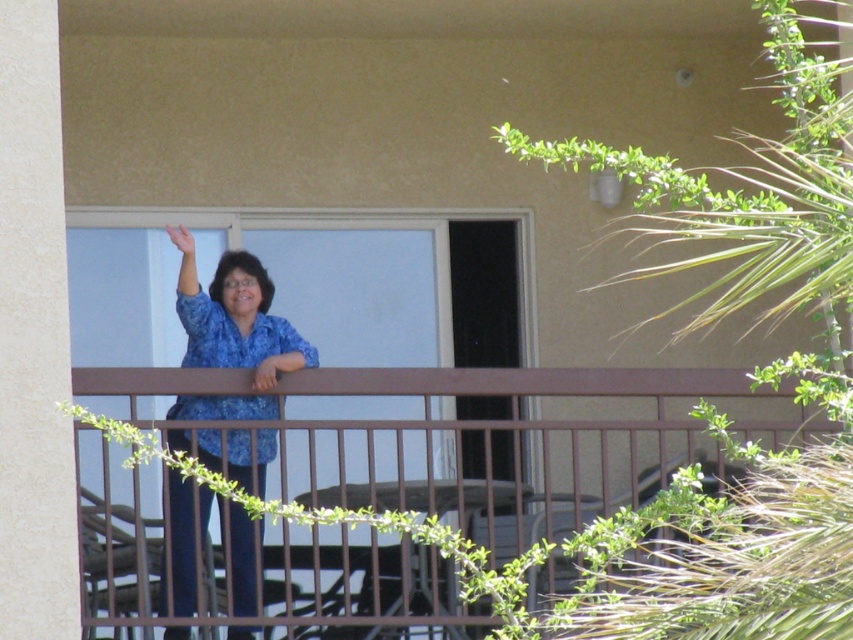
Question: Which point appears closest to the camera in this image?

Choices:
 (A) (262, 372)
 (B) (173, 557)
 (C) (184, 260)
 (D) (677, 556)

Answer: (D)

Question: Estimate the real-world distances between objects in this image. Which object is closer to the smooth brown hand at center?

Choices:
 (A) matte skin hand at upper center
 (B) matte blue shirt at upper left
 (C) blue printed blouse at center

Answer: (B)

Question: Where is brown metal railing at upper center located in relation to blue printed blouse at center in the image?

Choices:
 (A) right
 (B) left

Answer: (A)

Question: Among these objects, which one is farthest from the camera?

Choices:
 (A) blue printed blouse at center
 (B) matte skin hand at upper center
 (C) brown metal railing at upper center

Answer: (C)

Question: Can you confirm if blue printed blouse at center is bigger than smooth brown hand at center?

Choices:
 (A) yes
 (B) no

Answer: (A)

Question: Is brown metal railing at upper center above smooth brown hand at center?

Choices:
 (A) no
 (B) yes

Answer: (A)